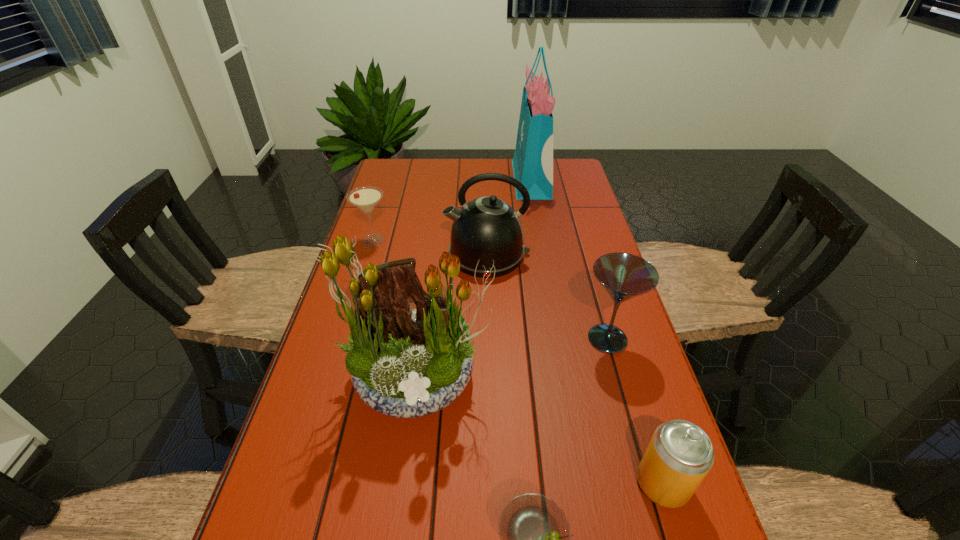
At what (x,y) coordinates should I click in order to perform the action: click on empty space between the rightmost martini and the farthest object. Please return your answer as a coordinate pair (x, y). Looking at the image, I should click on (569, 259).

You are a GUI agent. You are given a task and a screenshot of the screen. Output one action in this format:
    pyautogui.click(x=<x>, y=<y>)
    Task: Click on the object identified as the second closest to the farthest object
    The height and width of the screenshot is (540, 960).
    Given the screenshot: What is the action you would take?
    pyautogui.click(x=366, y=198)

You are a GUI agent. You are given a task and a screenshot of the screen. Output one action in this format:
    pyautogui.click(x=<x>, y=<y>)
    Task: Click on the third closest object relative to the kettle
    Image resolution: width=960 pixels, height=540 pixels.
    Given the screenshot: What is the action you would take?
    pyautogui.click(x=532, y=163)

Image resolution: width=960 pixels, height=540 pixels. I want to click on martini object that ranks as the second closest to the farthest martini, so click(x=535, y=535).

Where is `martini that is the closest to the flower arrangement`? The image size is (960, 540). martini that is the closest to the flower arrangement is located at coordinates (535, 535).